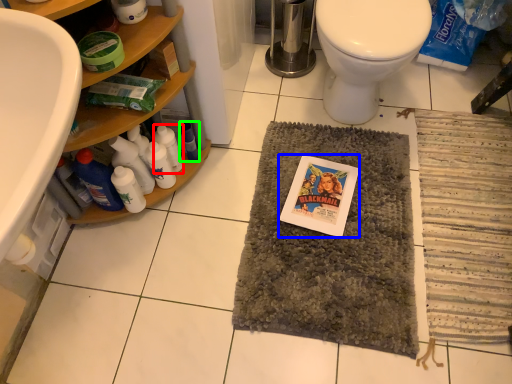
Question: Which is farther away from bottle (highlighted by a red box)? comic book (highlighted by a blue box) or bottle (highlighted by a green box)?

Choices:
 (A) comic book
 (B) bottle

Answer: (A)